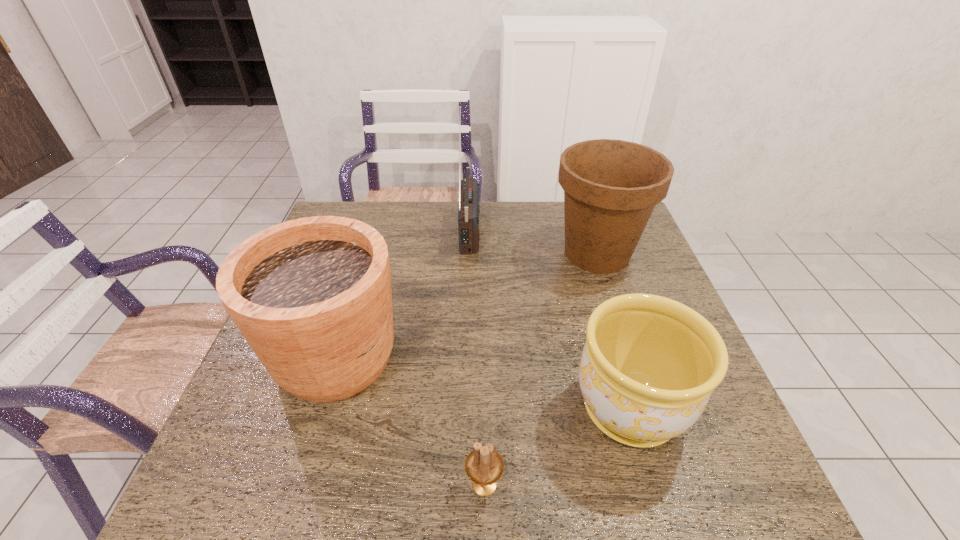
The height and width of the screenshot is (540, 960). I want to click on free space between the farthest flowerpot and the nearest object, so click(540, 369).

Locate an element on the screen. The height and width of the screenshot is (540, 960). unoccupied area between the radio receiver and the leftmost flowerpot is located at coordinates (403, 292).

Image resolution: width=960 pixels, height=540 pixels. In order to click on vacant region between the candle holder and the farthest flowerpot in this screenshot , I will do `click(540, 369)`.

Point out which object is positioned as the third nearest to the farthest flowerpot. Please provide its 2D coordinates. Your answer should be formatted as a tuple, i.e. [(x, y)], where the tuple contains the x and y coordinates of a point satisfying the conditions above.

[(312, 296)]

Select which object is the closest to the fourth tallest object. Please provide its 2D coordinates. Your answer should be formatted as a tuple, i.e. [(x, y)], where the tuple contains the x and y coordinates of a point satisfying the conditions above.

[(484, 466)]

Choose which flowerpot is the second nearest neighbor to the fourth tallest object. Please provide its 2D coordinates. Your answer should be formatted as a tuple, i.e. [(x, y)], where the tuple contains the x and y coordinates of a point satisfying the conditions above.

[(312, 296)]

Identify which flowerpot is the second nearest to the candle holder. Please provide its 2D coordinates. Your answer should be formatted as a tuple, i.e. [(x, y)], where the tuple contains the x and y coordinates of a point satisfying the conditions above.

[(312, 296)]

Locate an element on the screen. blank area in the image that satisfies the following two spatial constraints: 1. on the front-facing side of the nearest object; 2. on the right side of the radio receiver is located at coordinates (463, 485).

The height and width of the screenshot is (540, 960). I want to click on vacant position in the image that satisfies the following two spatial constraints: 1. on the front-facing side of the shortest object; 2. on the right side of the radio receiver, so click(x=463, y=485).

Where is `free space in the image that satisfies the following two spatial constraints: 1. on the front-facing side of the shortest object; 2. on the right side of the radio receiver`? This screenshot has width=960, height=540. free space in the image that satisfies the following two spatial constraints: 1. on the front-facing side of the shortest object; 2. on the right side of the radio receiver is located at coordinates (463, 485).